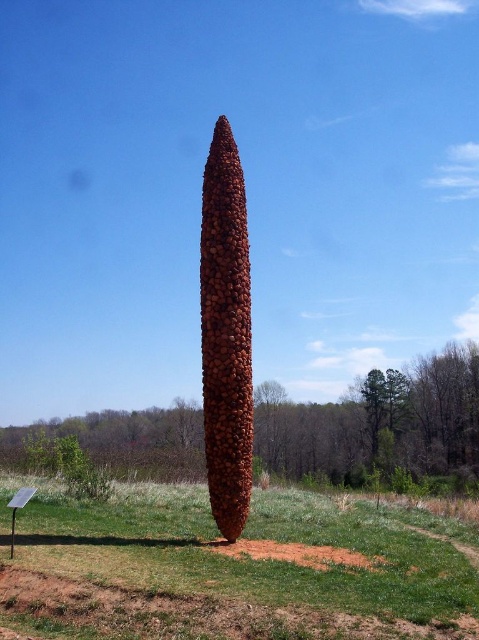
You are standing in front of the outdoor sculpture in the grassy field. You want to place a small decorative stone exactly where the green grass at center is located. What are the coordinates of the spot where you should place the stone?

The coordinates for the green grass at center are point (227,570).

You are an artist planning to place a new sculpture in the field. You have two objects in view, the brown textured sculpture at center and the brown textured pine cone at center. Which one is positioned to the left of the other?

The brown textured sculpture at center is positioned to the left of the brown textured pine cone at center.

You are standing in the grassy field and see the green grass at center and the brown textured sculpture at center. Which object is located to the right of the other?

The green grass at center is to the right of the brown textured sculpture at center.